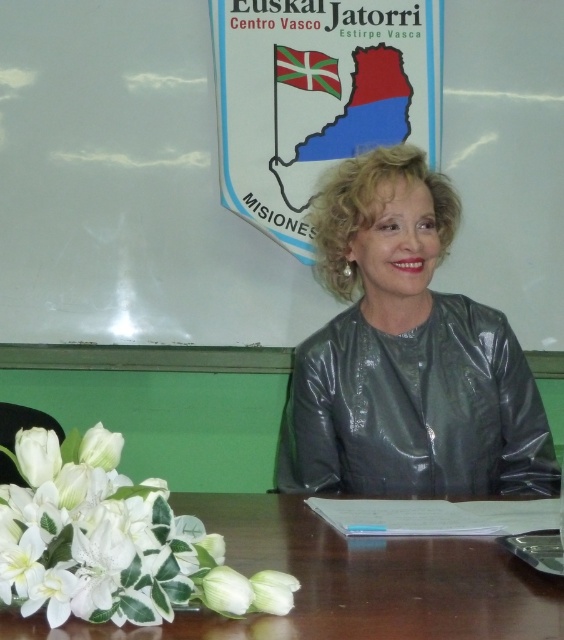
You are attending a meeting in this room and need to write something down. The whiteboard at upper center and the brown wooden table at lower center are both in your view. Which surface is closer to the left side of the room?

The whiteboard at upper center is closer to the left side of the room because it is positioned to the left of the brown wooden table at lower center.

You are organizing a meeting and need to place a laptop on the brown wooden table at lower center. Considering the size of the table and the white silk flowers at lower left, will there be enough space for the laptop?

The brown wooden table at lower center has a smaller size compared to white silk flowers at lower left, so there might not be enough space for the laptop.